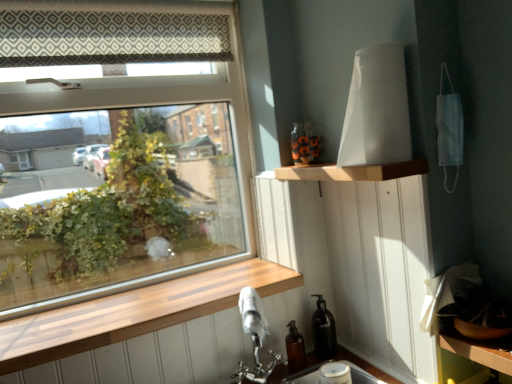
Locate an element on the screen. The height and width of the screenshot is (384, 512). empty space that is ontop of wooden at lower left is located at coordinates (161, 296).